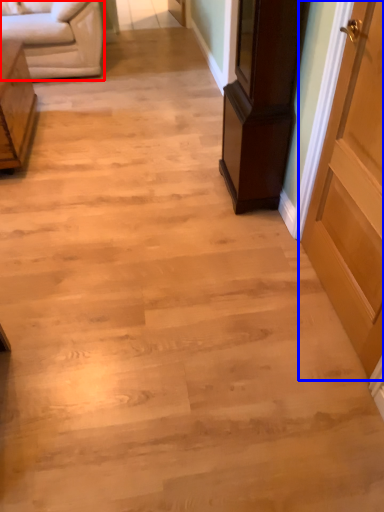
Question: Among these objects, which one is farthest to the camera, studio couch (highlighted by a red box) or door (highlighted by a blue box)?

Choices:
 (A) studio couch
 (B) door

Answer: (A)